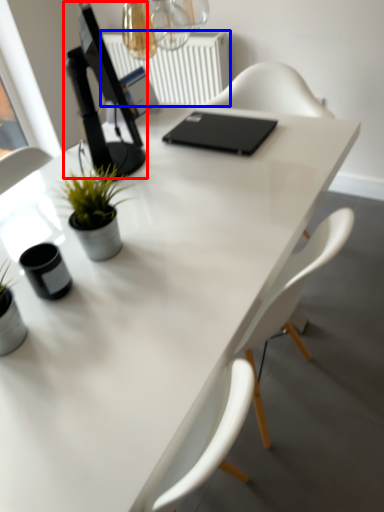
Question: Which object is closer to the camera taking this photo, computer monitor (highlighted by a red box) or radiator (highlighted by a blue box)?

Choices:
 (A) computer monitor
 (B) radiator

Answer: (A)